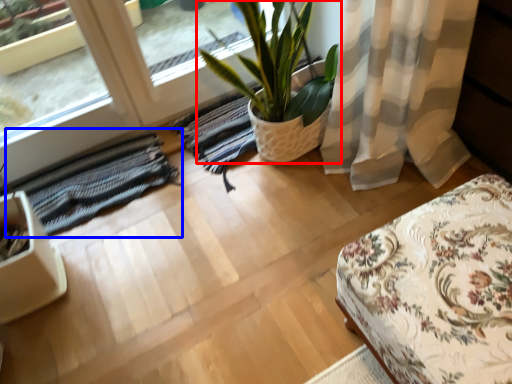
Question: Among these objects, which one is farthest to the camera, houseplant (highlighted by a red box) or mat (highlighted by a blue box)?

Choices:
 (A) houseplant
 (B) mat

Answer: (B)